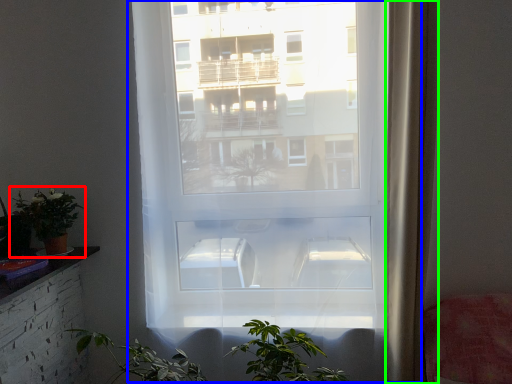
Question: Which object is positioned closest to houseplant (highlighted by a red box)? Select from window (highlighted by a blue box) and curtain (highlighted by a green box).

Choices:
 (A) window
 (B) curtain

Answer: (A)